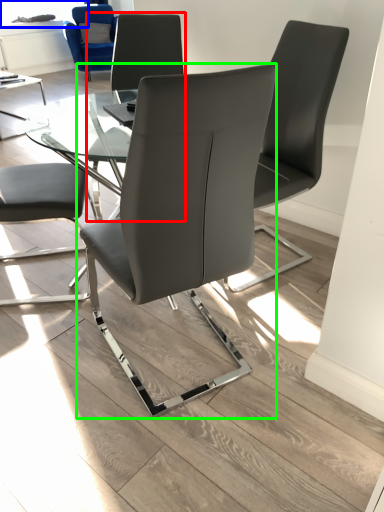
Question: Based on their relative distances, which object is nearer to chair (highlighted by a red box)? Choose from window screen (highlighted by a blue box) and chair (highlighted by a green box).

Choices:
 (A) window screen
 (B) chair

Answer: (B)